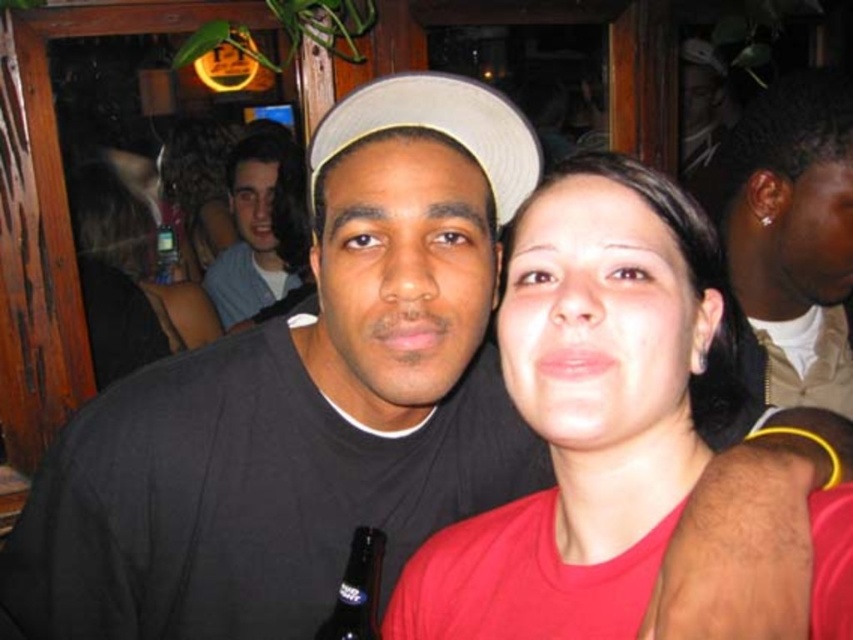
Is smooth skin at center to the left of light blue denim shirt at upper left from the viewer's perspective?

Correct, you'll find smooth skin at center to the left of light blue denim shirt at upper left.

Between point (117, 262) and point (286, 262), which one is positioned behind?

Point (117, 262)

Find the location of a particular element. The height and width of the screenshot is (640, 853). smooth skin at center is located at coordinates (128, 280).

Can you confirm if matte red shirt at center is taller than smooth skin at center?

No, matte red shirt at center is not taller than smooth skin at center.

Is matte red shirt at center smaller than smooth skin at center?

Correct, matte red shirt at center occupies less space than smooth skin at center.

Which is behind, point (672, 230) or point (106, 234)?

The point (106, 234) is more distant.

Locate an element on the screen. matte red shirt at center is located at coordinates (585, 413).

How much distance is there between smooth skin at center and transparent plastic bottle at upper left?

smooth skin at center and transparent plastic bottle at upper left are 26.79 centimeters apart from each other.

Is smooth skin at center above transparent plastic bottle at upper left?

Correct, smooth skin at center is located above transparent plastic bottle at upper left.

Locate an element on the screen. Image resolution: width=853 pixels, height=640 pixels. smooth skin at center is located at coordinates (128, 280).